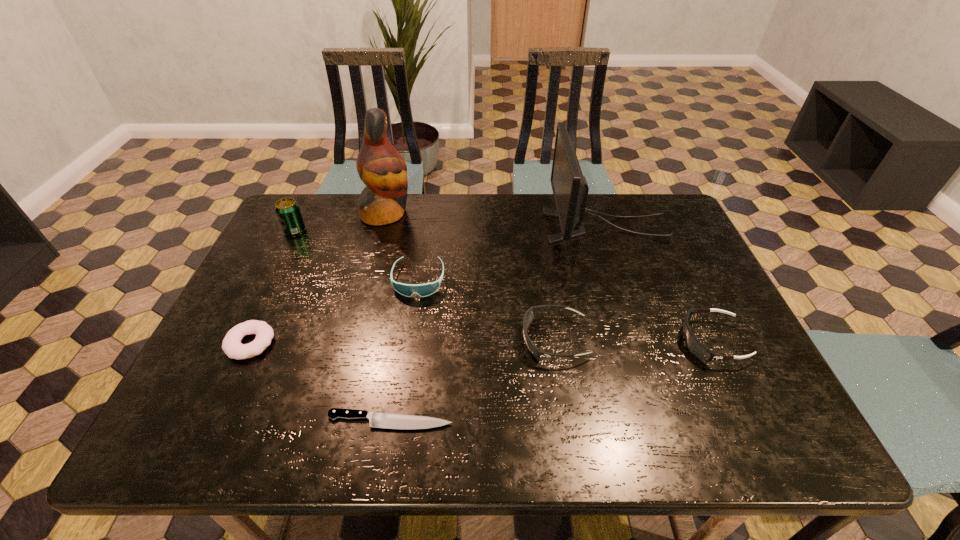
Locate an element on the screen. The width and height of the screenshot is (960, 540). parrot is located at coordinates (380, 166).

Where is `computer monitor`? computer monitor is located at coordinates (570, 189).

Where is `the third tallest object`? the third tallest object is located at coordinates (287, 210).

In order to click on the second goggles from right to left in this screenshot , I will do `click(529, 316)`.

The image size is (960, 540). I want to click on the rightmost goggles, so click(693, 344).

Locate an element on the screen. the fifth nearest object is located at coordinates (423, 290).

Find the location of `the leftmost goggles`. the leftmost goggles is located at coordinates (423, 290).

The image size is (960, 540). Identify the location of the second shortest object. (231, 345).

This screenshot has width=960, height=540. What are the coordinates of `the nearest object` in the screenshot? It's located at (377, 420).

Find the location of a particular element. The height and width of the screenshot is (540, 960). the shortest object is located at coordinates (377, 420).